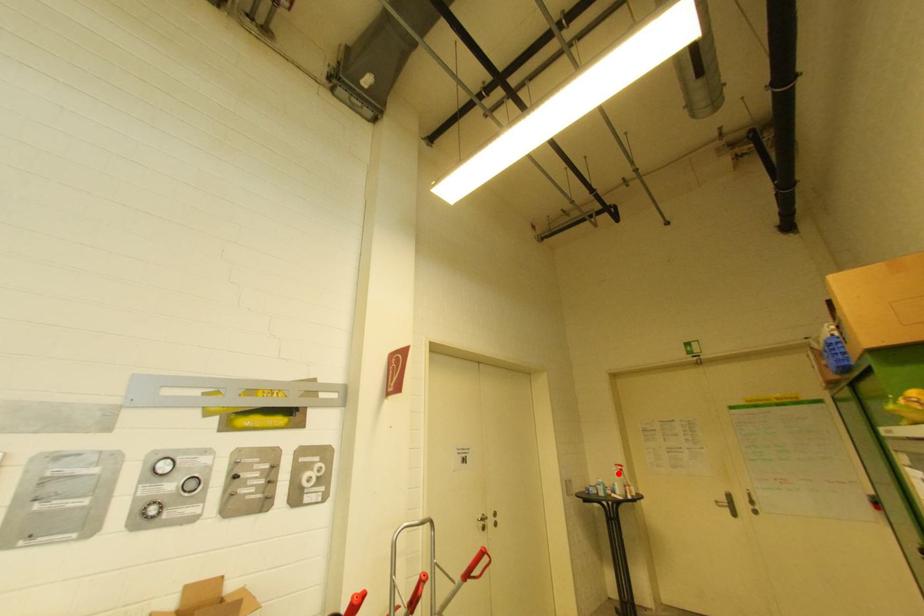
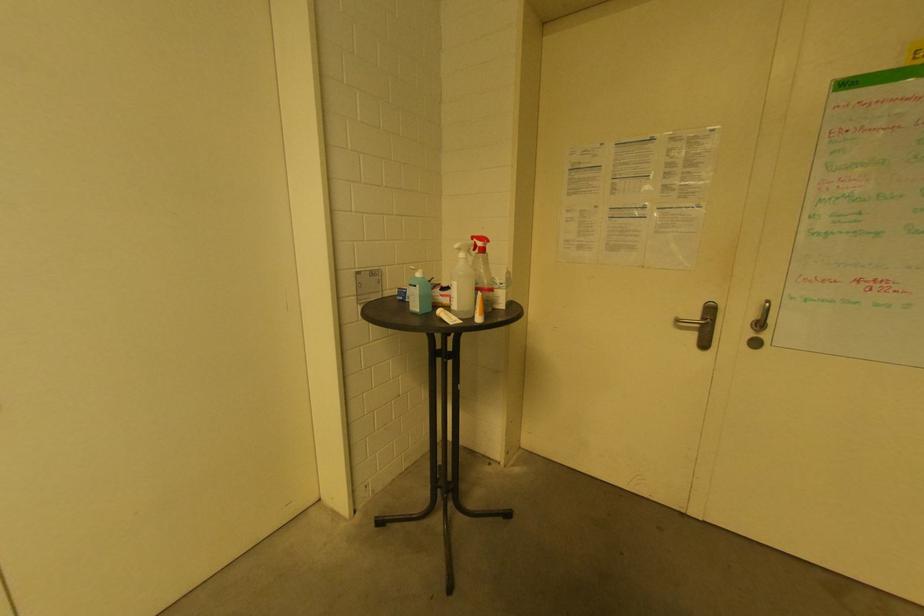
The point at the highlighted location is marked in the first image. Where is the corresponding point in the second image?

(464, 256)